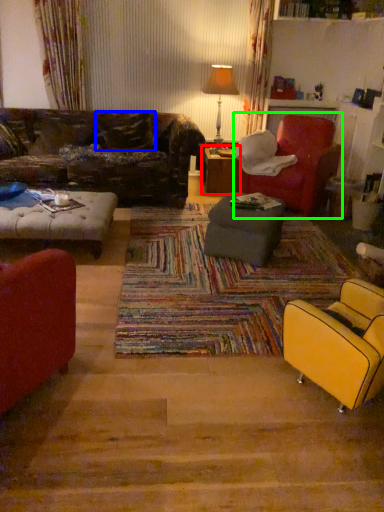
Question: Which is farther away from table (highlighted by a red box)? pillow (highlighted by a blue box) or chair (highlighted by a green box)?

Choices:
 (A) pillow
 (B) chair

Answer: (A)